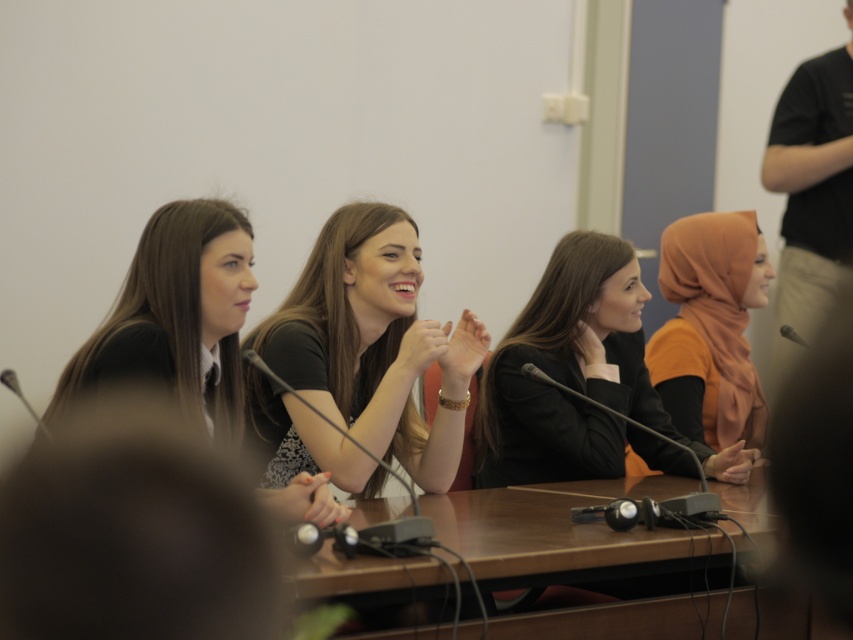
Question: Which of the following is the closest to the observer?

Choices:
 (A) matte black jacket at center
 (B) orange satin hijab at right
 (C) matte black shirt at center
 (D) brown wooden table at center

Answer: (D)

Question: Which of the following is the closest to the observer?

Choices:
 (A) matte black shirt at center
 (B) matte black jacket at center
 (C) orange satin hijab at right
 (D) brown wooden table at center

Answer: (D)

Question: Can you confirm if matte black shirt at center is bigger than black matte shirt at left?

Choices:
 (A) no
 (B) yes

Answer: (B)

Question: Is matte black shirt at center closer to the viewer compared to black matte shirt at left?

Choices:
 (A) no
 (B) yes

Answer: (A)

Question: Does matte black jacket at center have a larger size compared to orange satin hijab at right?

Choices:
 (A) yes
 (B) no

Answer: (A)

Question: Which of the following is the farthest from the observer?

Choices:
 (A) brown wooden table at center
 (B) matte black shirt at center
 (C) orange satin hijab at right
 (D) matte black jacket at center

Answer: (C)